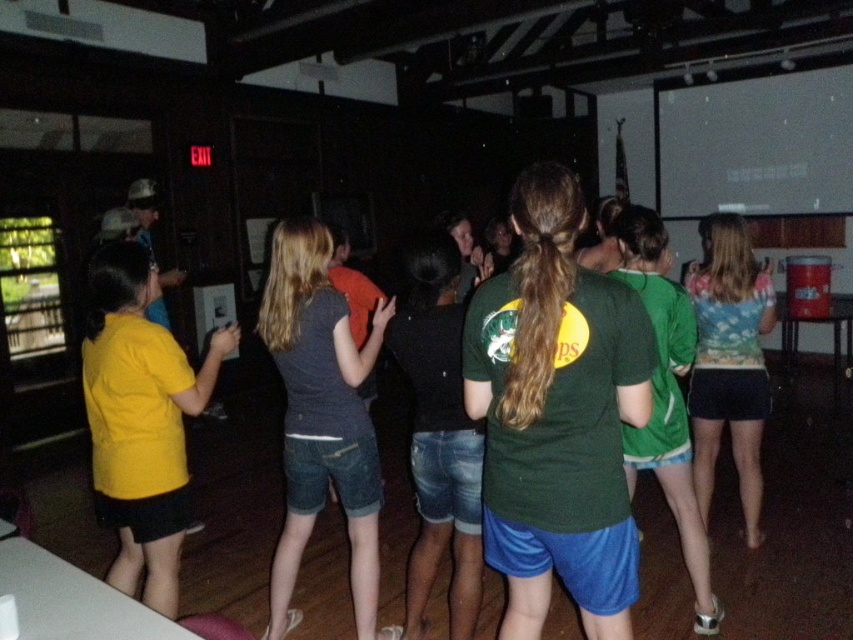
Is printed cotton shirt at center closer to camera compared to green jersey at center?

No, it is behind green jersey at center.

Between printed cotton shirt at center and green jersey at center, which one is positioned lower?

green jersey at center

Measure the distance between point (x=756, y=369) and camera.

3.34 meters

Find the location of `printed cotton shirt at center`. printed cotton shirt at center is located at coordinates (729, 362).

Is dark gray denim shorts at center shorter than printed cotton shirt at center?

Incorrect, dark gray denim shorts at center's height does not fall short of printed cotton shirt at center's.

Between point (318, 481) and point (718, 365), which one is positioned behind?

Positioned behind is point (718, 365).

Between point (289, 227) and point (733, 353), which one is positioned behind?

The point (733, 353) is more distant.

The image size is (853, 640). Find the location of `dark gray denim shorts at center`. dark gray denim shorts at center is located at coordinates (321, 417).

Is dark gray denim shorts at center smaller than green jersey at center?

Yes.

Is dark gray denim shorts at center to the right of green jersey at center from the viewer's perspective?

No, dark gray denim shorts at center is not to the right of green jersey at center.

In order to click on dark gray denim shorts at center in this screenshot , I will do `click(321, 417)`.

Locate an element on the screen. This screenshot has height=640, width=853. dark gray denim shorts at center is located at coordinates (321, 417).